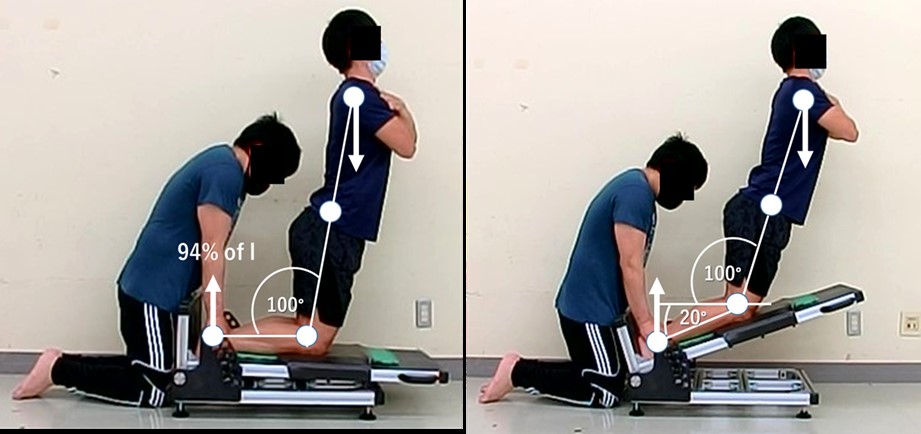
This screenshot has width=921, height=434. Find the location of `wall`. wall is located at coordinates (157, 58), (668, 57).